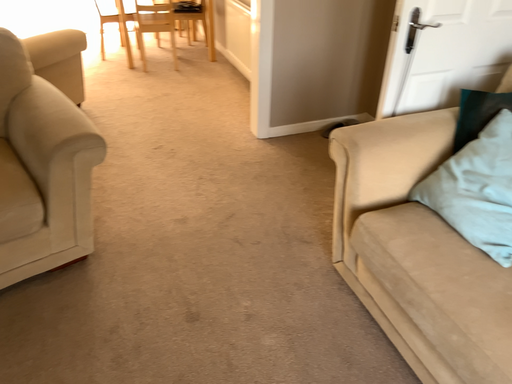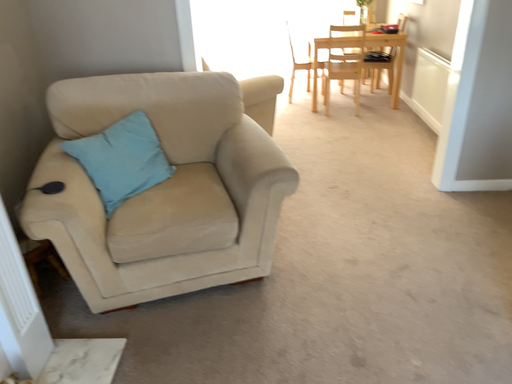
Question: How did the camera likely rotate when shooting the video?

Choices:
 (A) rotated left
 (B) rotated right

Answer: (A)